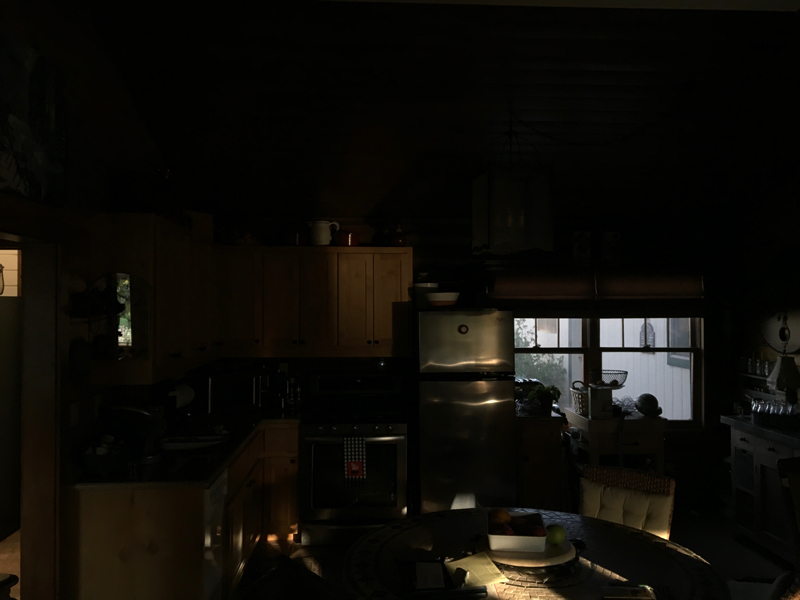
Where is `fridge`? The height and width of the screenshot is (600, 800). fridge is located at coordinates (438, 349).